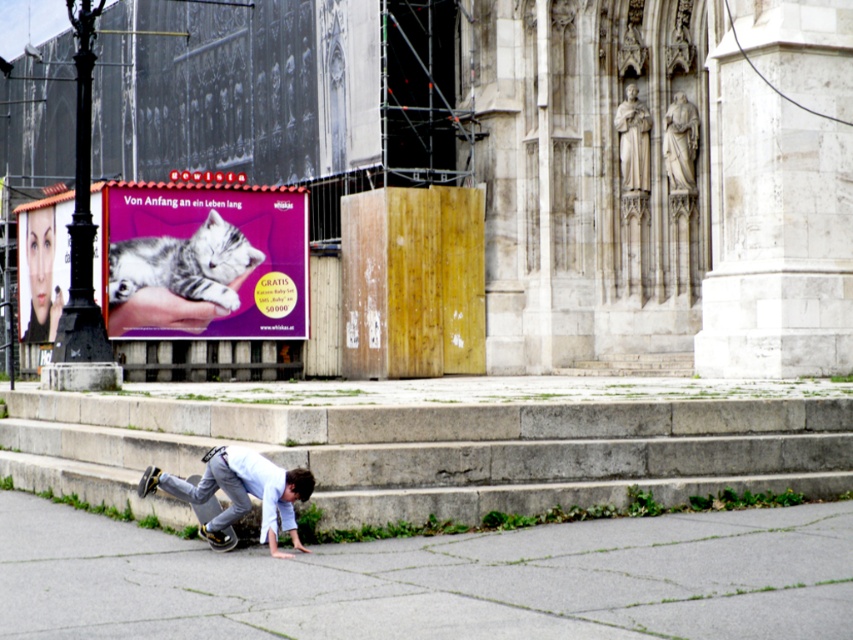
Question: Which of the following is the closest to the observer?

Choices:
 (A) light blue denim squat at lower center
 (B) gray concrete pavement at lower left
 (C) concrete stairs at lower center

Answer: (B)

Question: Which object is positioned farthest from the concrete stairs at lower center?

Choices:
 (A) gray concrete pavement at lower left
 (B) matte purple cat at upper left
 (C) matte purple poster at upper center
 (D) light blue denim squat at lower center

Answer: (C)

Question: Which object is the closest to the gray concrete pavement at lower left?

Choices:
 (A) light blue denim squat at lower center
 (B) matte purple cat at upper left
 (C) concrete stairs at lower center
 (D) matte purple poster at upper center

Answer: (A)

Question: Is gray concrete pavement at lower left further to camera compared to matte purple cat at upper left?

Choices:
 (A) yes
 (B) no

Answer: (B)

Question: Considering the relative positions of gray concrete pavement at lower left and light blue denim squat at lower center in the image provided, where is gray concrete pavement at lower left located with respect to light blue denim squat at lower center?

Choices:
 (A) above
 (B) below

Answer: (B)

Question: Is gray concrete pavement at lower left to the left of matte purple cat at upper left from the viewer's perspective?

Choices:
 (A) yes
 (B) no

Answer: (B)